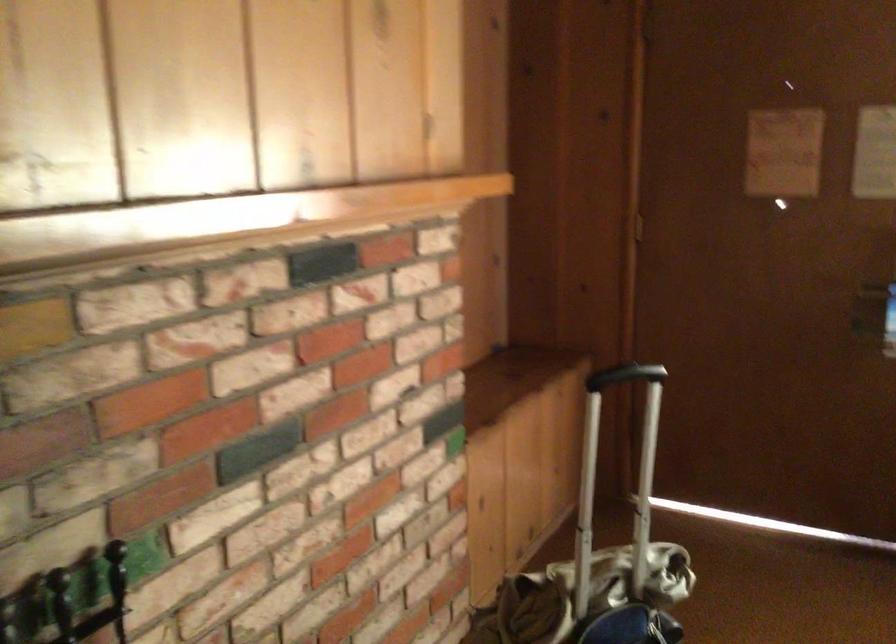
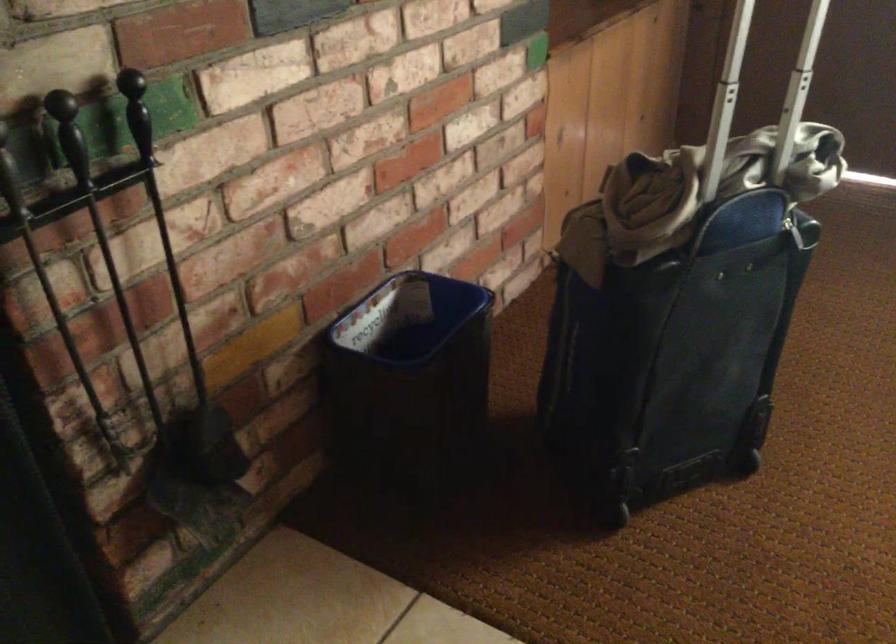
Question: How did the camera likely rotate?

Choices:
 (A) Left
 (B) Right
 (C) Up
 (D) Down

Answer: (D)